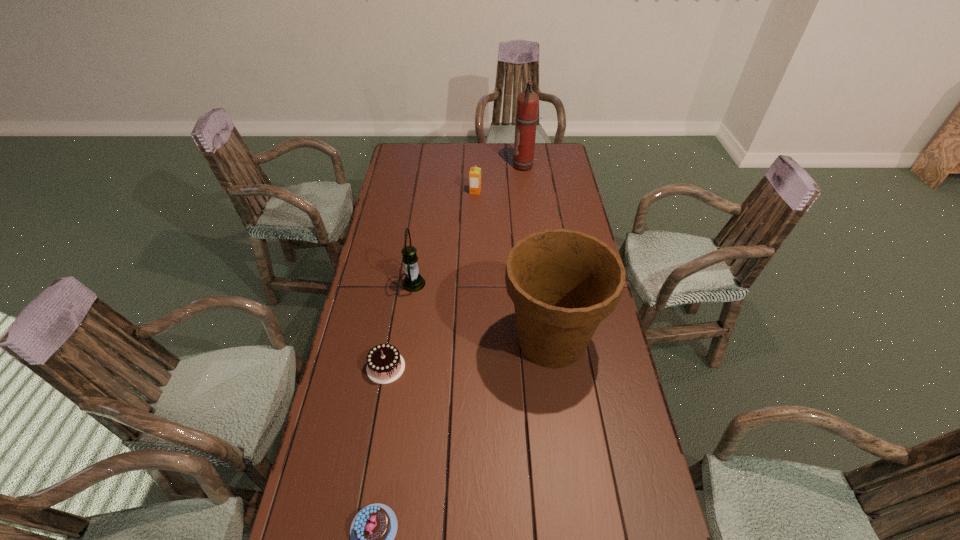
The height and width of the screenshot is (540, 960). Identify the location of the tallest object. (527, 101).

The height and width of the screenshot is (540, 960). Identify the location of fire extinguisher. (527, 101).

The image size is (960, 540). In order to click on the fifth shortest object in this screenshot , I will do `click(563, 283)`.

Identify the location of lantern. (413, 281).

The width and height of the screenshot is (960, 540). I want to click on the fourth shortest object, so click(413, 281).

Where is `orange juice`? orange juice is located at coordinates (475, 173).

This screenshot has height=540, width=960. Find the location of `the fourth tallest object`. the fourth tallest object is located at coordinates (475, 173).

Where is `the farther chocolate cake`? The width and height of the screenshot is (960, 540). the farther chocolate cake is located at coordinates (385, 364).

You are a GUI agent. You are given a task and a screenshot of the screen. Output one action in this format:
    pyautogui.click(x=<x>, y=<y>)
    Task: Click on the fifth tallest object
    
    Given the screenshot: What is the action you would take?
    pyautogui.click(x=385, y=364)

Locate an element on the screen. blank space located on the side of the farthest object with the label and nozzle is located at coordinates (480, 166).